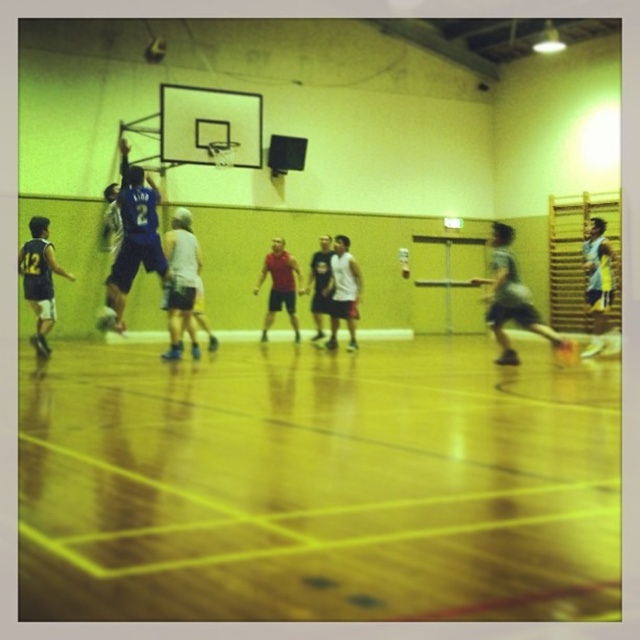
Is yellow polished wood basketball court at center further to camera compared to blue jersey at center?

No, yellow polished wood basketball court at center is in front of blue jersey at center.

Which is in front, point (266, 532) or point (276, 212)?

Point (266, 532) is more forward.

I want to click on yellow polished wood basketball court at center, so click(x=316, y=484).

Which of these two, blue jersey at center or shiny metallic basketball at center, stands taller?

With more height is blue jersey at center.

Can you confirm if blue jersey at center is positioned to the right of shiny metallic basketball at center?

Indeed, blue jersey at center is positioned on the right side of shiny metallic basketball at center.

Does point (97, 323) lie behind point (144, 56)?

No, it is in front of (144, 56).

Identify the location of blue jersey at center. Image resolution: width=640 pixels, height=640 pixels. (419, 264).

Does point (467, 488) come in front of point (340, 264)?

Yes, it is in front of point (340, 264).

Where is `yellow polished wood basketball court at center`? yellow polished wood basketball court at center is located at coordinates (316, 484).

Where is `yellow polished wood basketball court at center`? The image size is (640, 640). yellow polished wood basketball court at center is located at coordinates (316, 484).